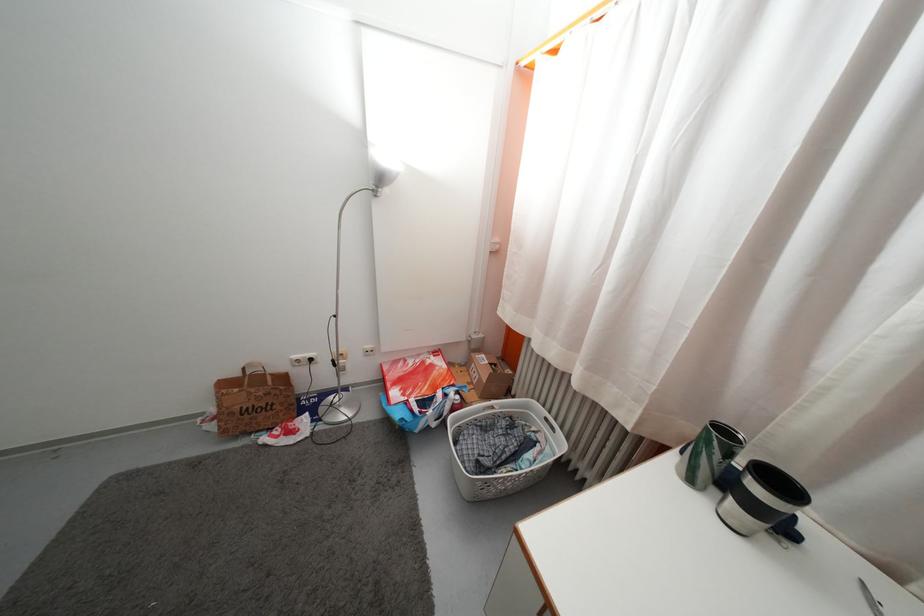
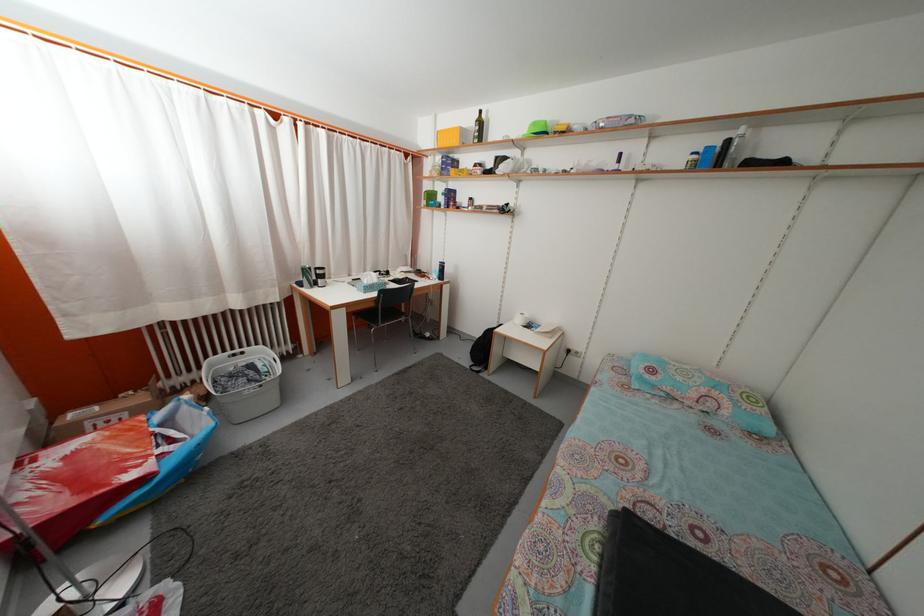
Question: I am providing you with two images of the same scene from different viewpoints. Which of the following objects are not visible in image2?

Choices:
 (A) green glass bottle
 (B) small jam jar
 (C) black mug handle
 (D) black travel mug

Answer: (C)